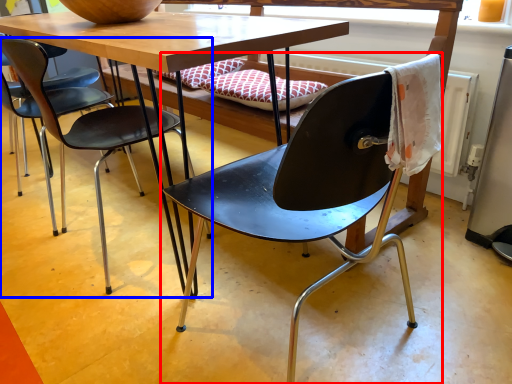
Question: Among these objects, which one is nearest to the camera, chair (highlighted by a red box) or chair (highlighted by a blue box)?

Choices:
 (A) chair
 (B) chair

Answer: (A)